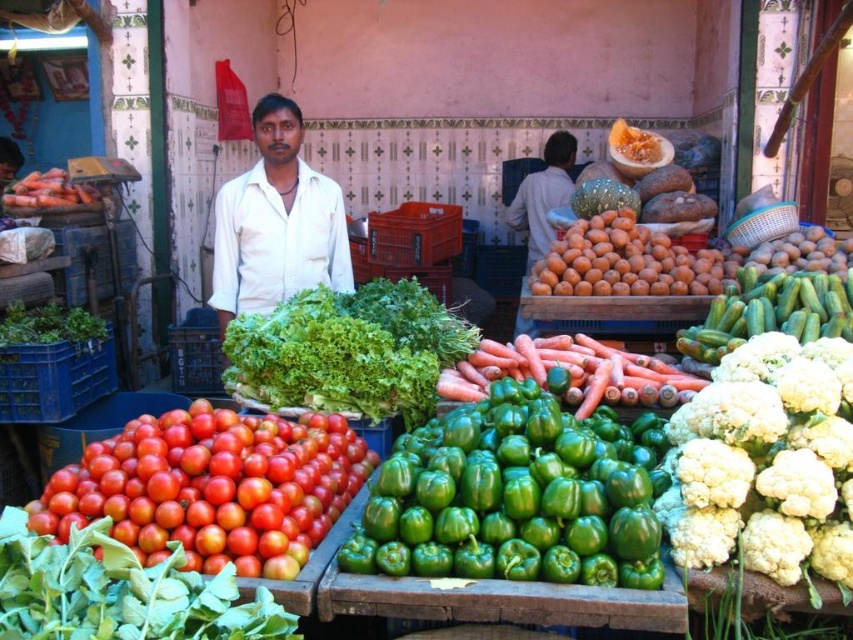
You are standing at the market stall and want to grab the green glossy bell pepper at center. Considering your arm length is 2.5 feet, can you reach it without moving closer?

The green glossy bell pepper at center is 5.79 feet away from the viewer. Since your arm length is 2.5 feet, you cannot reach it without moving closer.

Looking at this image, you are a customer at the market stall and want to pick up an item from the table. You notice two points on the table surface. The first point is at coordinate point (462, 346) and the second is at point (601, 342). Which point is closer to you?

Point (462, 346) is closer to the camera than point (601, 342), so the first point is closer to you.

You are a customer at the market stall and want to pick up the green glossy bell pepper at center and the white fluffy cauliflower at right. Which one should you reach for first if you want to grab the one closer to you?

The green glossy bell pepper at center is located below the white fluffy cauliflower at right, meaning it is closer to you. Therefore, you should reach for the green glossy bell pepper at center first.